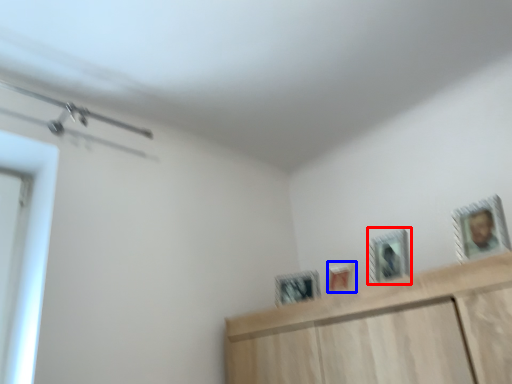
Question: Which of the following is the farthest to the observer, picture frame (highlighted by a red box) or picture frame (highlighted by a blue box)?

Choices:
 (A) picture frame
 (B) picture frame

Answer: (B)